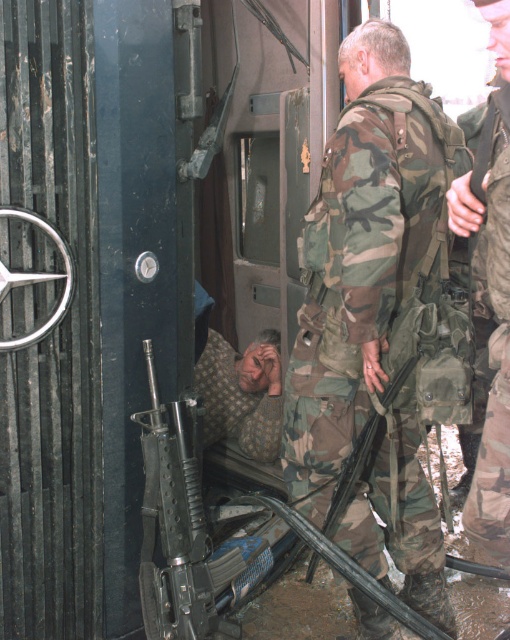
Can you confirm if camouflage fabric uniform at center is bigger than camouflage uniform at center?

Indeed, camouflage fabric uniform at center has a larger size compared to camouflage uniform at center.

What do you see at coordinates (361, 252) in the screenshot? I see `camouflage fabric uniform at center` at bounding box center [361, 252].

In the scene shown: Measure the distance between camouflage fabric uniform at center and camera.

camouflage fabric uniform at center and camera are 6.41 feet apart from each other.

Locate an element on the screen. Image resolution: width=510 pixels, height=640 pixels. camouflage fabric uniform at center is located at coordinates (361, 252).